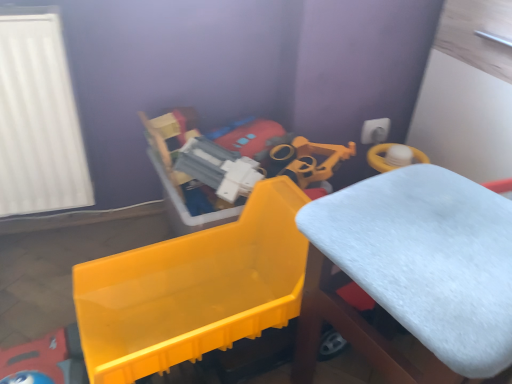
You are a GUI agent. You are given a task and a screenshot of the screen. Output one action in this format:
    pyautogui.click(x=<x>, y=<y>)
    Task: Click on the free point above white fluffy cushion at center (from a real-world perspective)
    
    Given the screenshot: What is the action you would take?
    pyautogui.click(x=444, y=225)